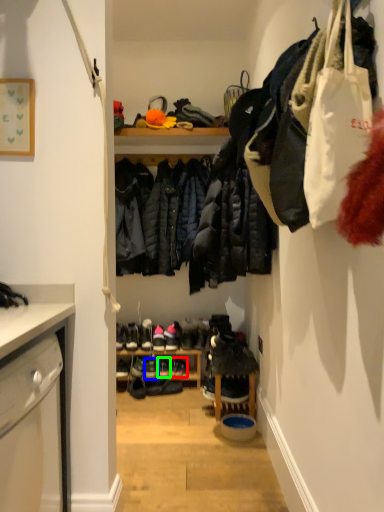
Question: Estimate the real-world distances between objects in this image. Which object is closer to footwear (highlighted by a red box), footwear (highlighted by a blue box) or footwear (highlighted by a green box)?

Choices:
 (A) footwear
 (B) footwear

Answer: (B)